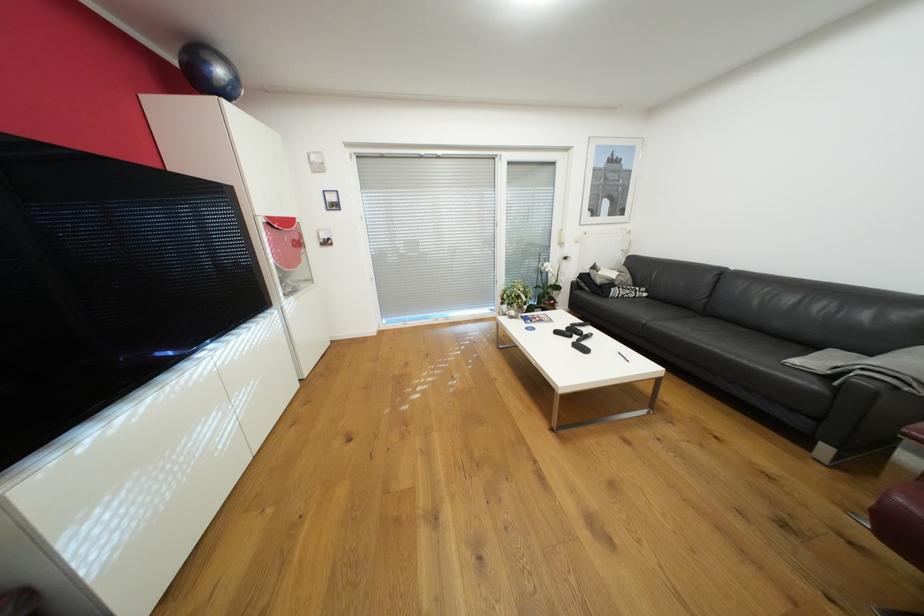
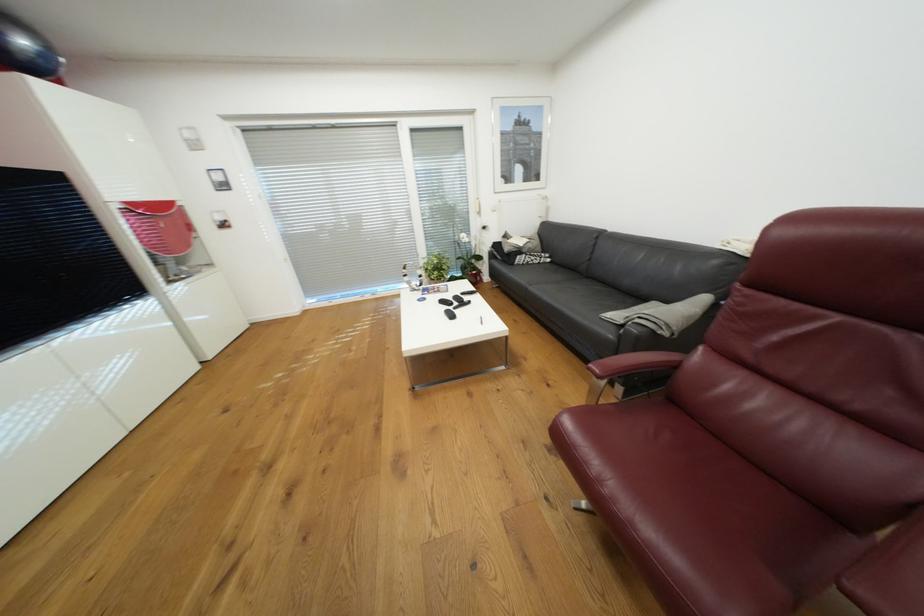
In the second image, find the point that corresponds to the point at 618,284 in the first image.

(526, 252)